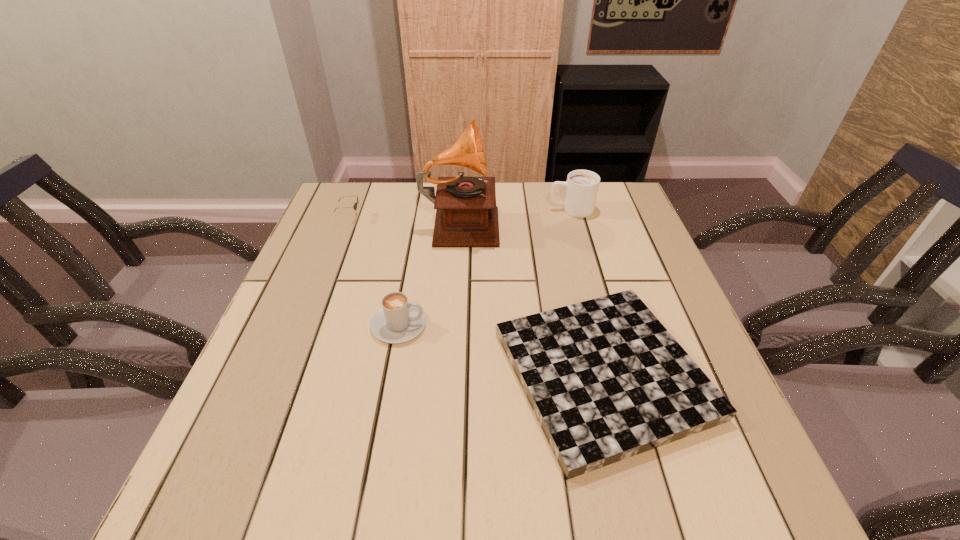
The height and width of the screenshot is (540, 960). I want to click on empty location between the left cappuccino and the tallest object, so click(430, 273).

This screenshot has width=960, height=540. I want to click on free space between the shortest object and the nearer cappuccino, so coord(501,349).

I want to click on free spot between the second tallest object and the shortest object, so click(588, 292).

Identify the location of free space between the second tallest object and the shorter cappuccino. The height and width of the screenshot is (540, 960). (485, 267).

This screenshot has width=960, height=540. I want to click on free space between the shortest object and the sunglasses, so click(476, 296).

Identify the location of blank region between the checkerboard and the leftmost object. The image size is (960, 540). (476, 296).

The image size is (960, 540). I want to click on unoccupied position between the right cappuccino and the nearer cappuccino, so click(x=485, y=267).

The image size is (960, 540). I want to click on unoccupied position between the sunglasses and the shortest object, so (x=476, y=296).

Locate an element on the screen. This screenshot has height=540, width=960. object identified as the third closest to the nearer cappuccino is located at coordinates (355, 205).

This screenshot has height=540, width=960. I want to click on object that is the fourth closest to the checkerboard, so click(355, 205).